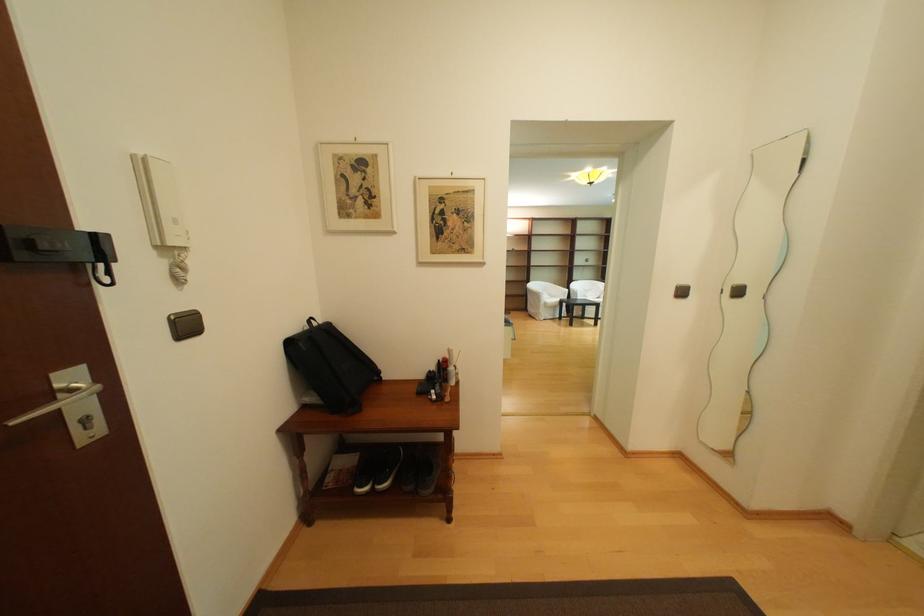
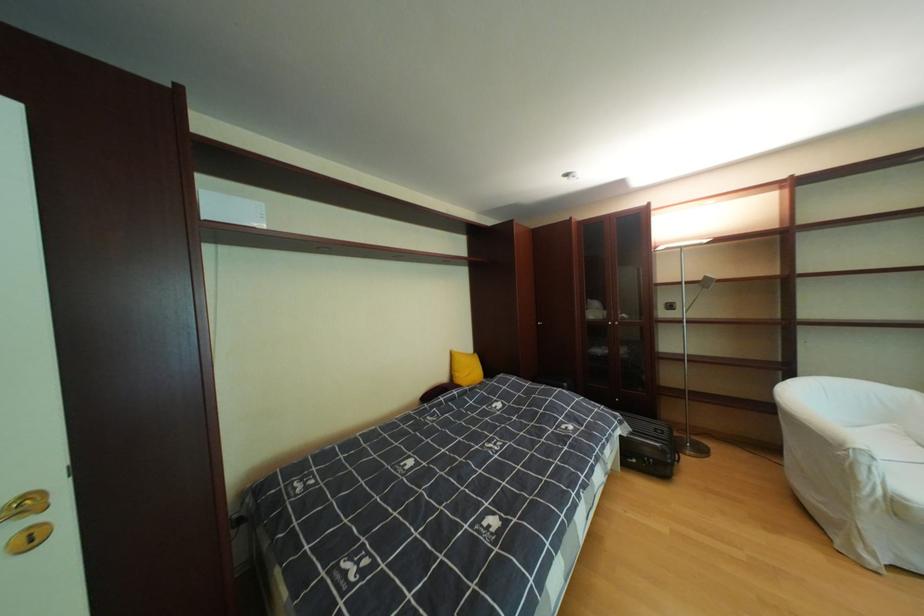
Locate, in the second image, the point that corresponds to point (556, 305) in the first image.

(908, 506)